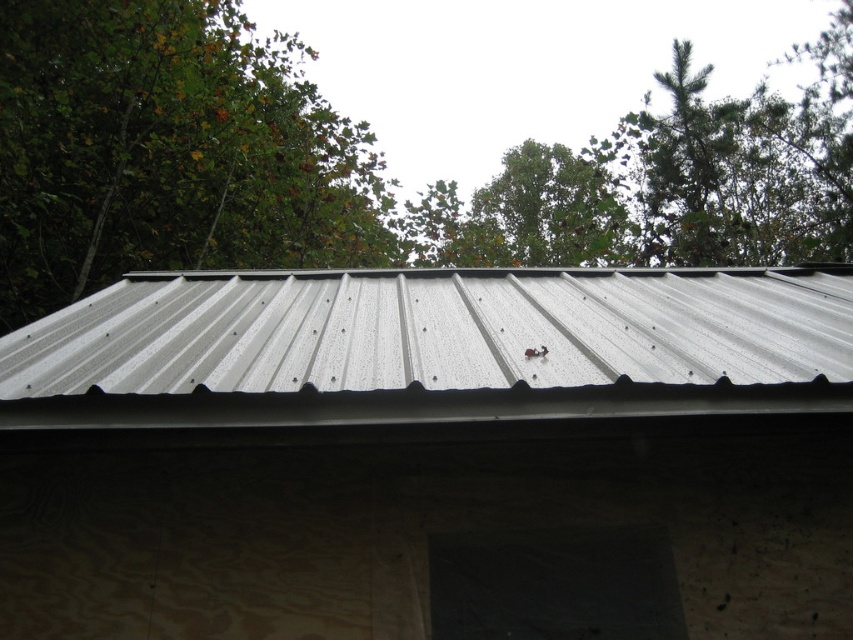
You are an inspector checking the roof for potential hazards. You notice two green leafy trees nearby. Which tree is closer to the right edge of the roof? The green leafy tree at upper center or the green leafy tree at upper left?

The green leafy tree at upper center is positioned on the right side of the green leafy tree at upper left, so the green leafy tree at upper center is closer to the right edge of the roof.

You are standing on the roof and see the point at coordinates (368, 163). What object does this point correspond to?

The point at coordinates (368, 163) corresponds to the green leafy tree at upper center.

You are a construction worker standing on the roof. You need to locate the metallic gray roof at center. Where is it positioned relative to your current location?

The metallic gray roof at center is positioned at point [432,348] relative to your current location.